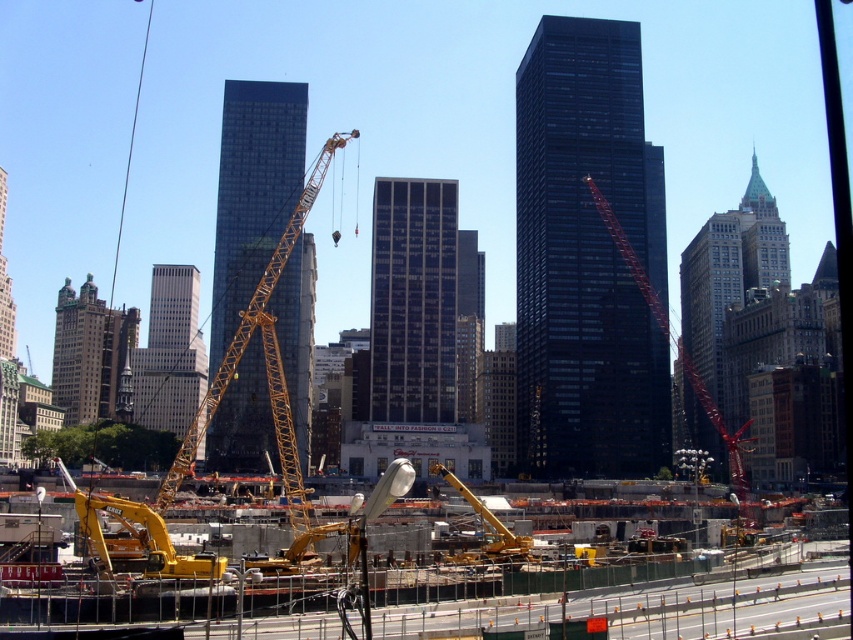
Based on the photo, you are a delivery truck driver who needs to navigate through the construction site. You see the yellow metallic excavator at lower center and the yellow metallic crane at center. Which of these two objects is wider and might require more space to maneuver around?

The yellow metallic excavator at lower center is wider than the yellow metallic crane at center, so it would require more space to maneuver around.

You are a construction worker standing at the yellow metallic excavator at lower center. You need to move a heavy beam to the yellow metallic crane at center. Which direction should you move the beam to reach the crane?

The yellow metallic excavator at lower center is below the yellow metallic crane at center, so you should move the beam upward to reach the crane.